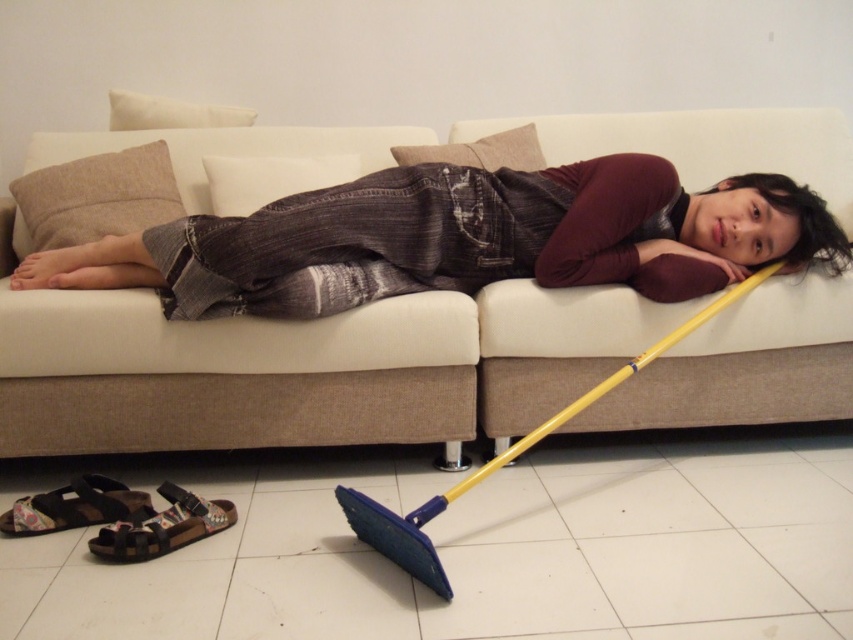
Is white fabric couch at center thinner than denim jeans at center?

Incorrect, white fabric couch at center's width is not less than denim jeans at center's.

Is point (836, 349) farther from viewer compared to point (503, 221)?

Yes, it is.

Does point (49, 157) lie behind point (468, 269)?

Yes, point (49, 157) is behind point (468, 269).

Identify the location of white fabric couch at center. (306, 369).